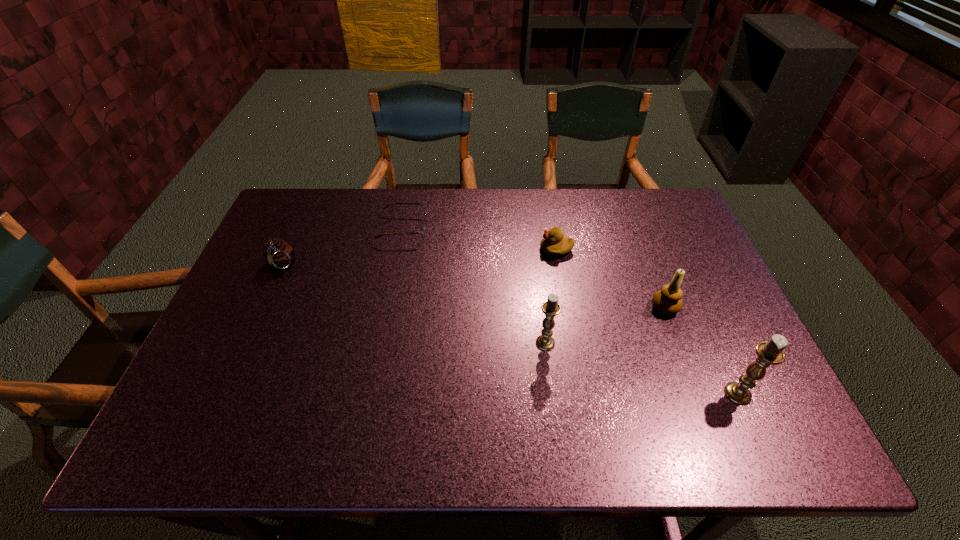
Locate an element on the screen. The width and height of the screenshot is (960, 540). the second shortest object is located at coordinates (554, 243).

Locate an element on the screen. free location located 0.400m on the right of the second shortest candle_holder is located at coordinates (716, 343).

In order to click on vacant area situated on the back of the tallest candle_holder in this screenshot , I will do `click(692, 293)`.

The image size is (960, 540). In order to click on free space located 0.240m with a leaf charm attached to the pinecone in this screenshot , I will do `click(245, 349)`.

This screenshot has height=540, width=960. I want to click on vacant area situated 0.120m on the front-facing side of the spectacles, so click(x=466, y=228).

Locate an element on the screen. vacant area situated 0.100m on the right of the farthest candle_holder is located at coordinates (718, 308).

Image resolution: width=960 pixels, height=540 pixels. I want to click on free space located 0.090m on the front-facing side of the fifth tallest object, so click(x=510, y=249).

Identify the location of vacant space positioned on the front-facing side of the fifth tallest object. The height and width of the screenshot is (540, 960). (438, 249).

This screenshot has width=960, height=540. Identify the location of vacant space located on the front-facing side of the fifth tallest object. (451, 249).

The width and height of the screenshot is (960, 540). In order to click on object that is at the far edge in this screenshot , I will do `click(423, 228)`.